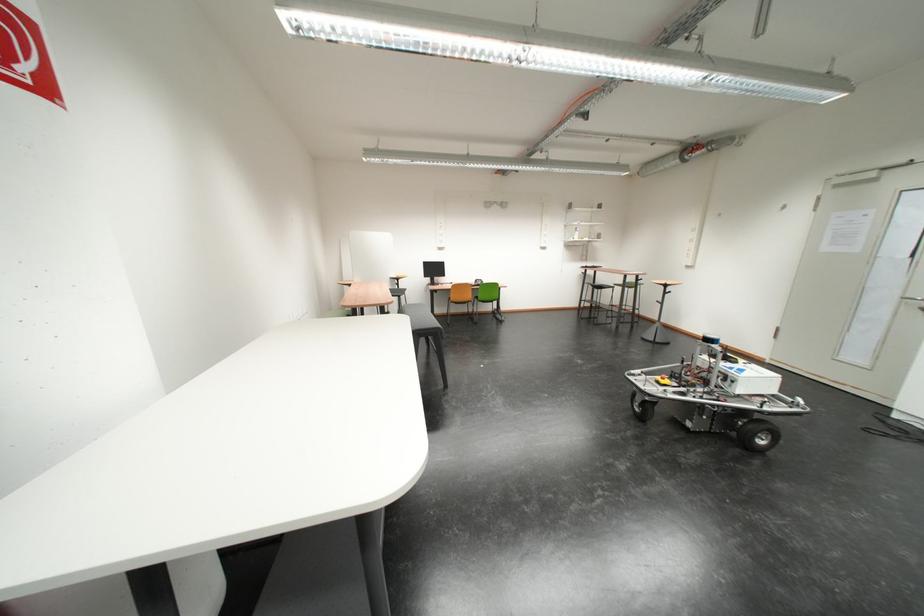
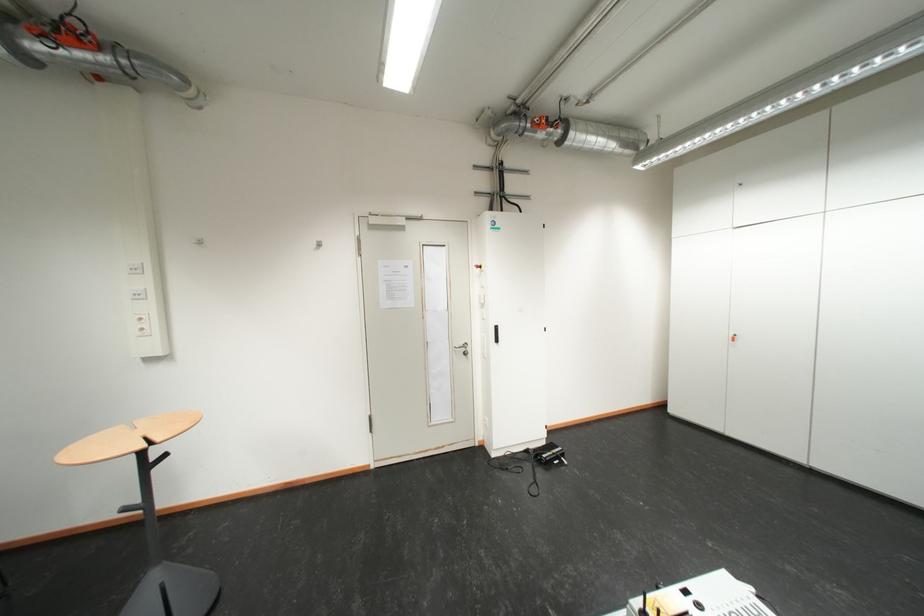
Find the pixel in the second image that matches [697,163] in the first image.

(35, 60)